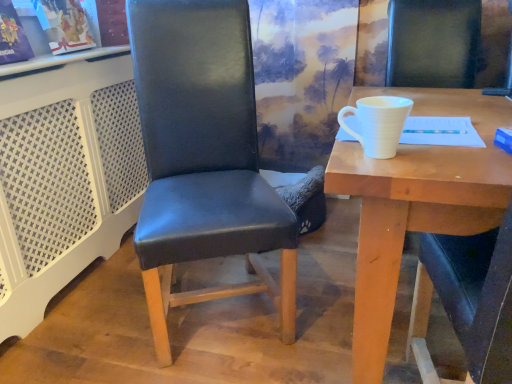
At what (x,y) coordinates should I click in order to perform the action: click on vacant area that lies to the right of white matte cup at right. Please return your answer as a coordinate pair (x, y). Image resolution: width=512 pixels, height=384 pixels. Looking at the image, I should click on (454, 153).